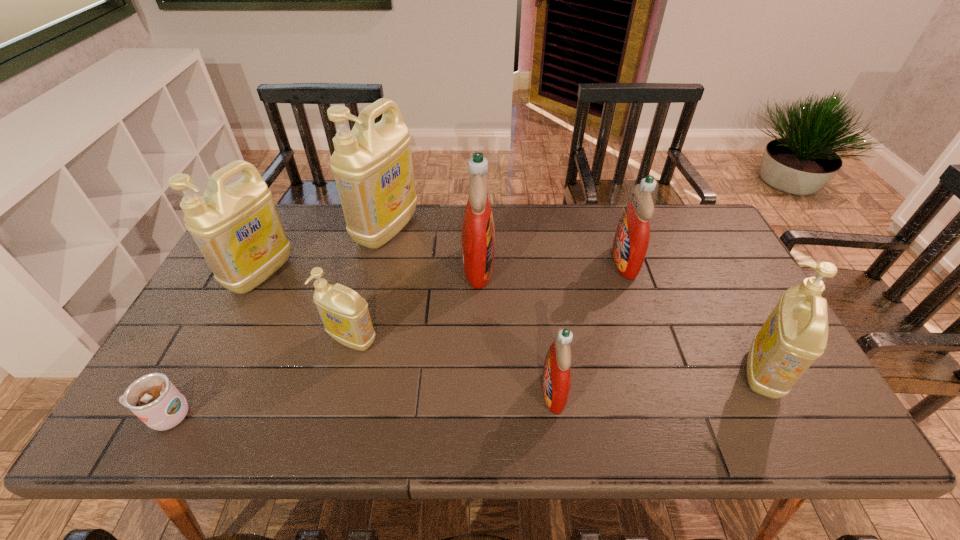
This screenshot has width=960, height=540. In order to click on vacant space situated 0.070m on the front of the rightmost object in this screenshot , I will do `click(796, 435)`.

At what (x,y) coordinates should I click in order to perform the action: click on free space located on the right of the smallest beige detergent. Please return your answer as a coordinate pair (x, y). Looking at the image, I should click on (405, 339).

Locate an element on the screen. The image size is (960, 540). vacant area situated on the front surface of the smallest red detergent is located at coordinates (452, 392).

You are a GUI agent. You are given a task and a screenshot of the screen. Output one action in this format:
    pyautogui.click(x=<x>, y=<y>)
    Task: Click on the vacant area situated on the front surface of the smallest red detergent
    The width and height of the screenshot is (960, 540).
    Given the screenshot: What is the action you would take?
    pyautogui.click(x=444, y=392)

Where is `free space located on the front surface of the smallest red detergent`? The width and height of the screenshot is (960, 540). free space located on the front surface of the smallest red detergent is located at coordinates (379, 392).

Locate an element on the screen. This screenshot has width=960, height=540. cup present at the near edge is located at coordinates (153, 398).

Where is `detergent present at the left edge`? The width and height of the screenshot is (960, 540). detergent present at the left edge is located at coordinates (237, 228).

In order to click on cup present at the left edge in this screenshot , I will do `click(153, 398)`.

At what (x,y) coordinates should I click in order to perform the action: click on object positioned at the right edge. Please return your answer as a coordinate pair (x, y). The width and height of the screenshot is (960, 540). Looking at the image, I should click on (795, 334).

Locate an element on the screen. object that is at the far left corner is located at coordinates (237, 228).